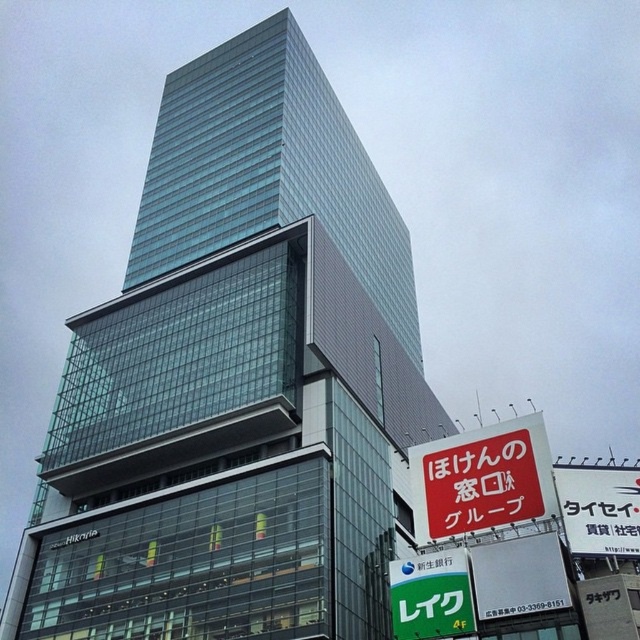
Question: Among these points, which one is farthest from the camera?

Choices:
 (A) coord(380,582)
 (B) coord(531,442)
 (C) coord(394,572)

Answer: (A)

Question: Is transparent glass building at center further to the viewer compared to red paper sign at lower right?

Choices:
 (A) yes
 (B) no

Answer: (A)

Question: Estimate the real-world distances between objects in this image. Which object is farther from the green plastic sign at lower center?

Choices:
 (A) red paper sign at lower right
 (B) transparent glass building at center

Answer: (B)

Question: Does transparent glass building at center appear on the right side of green plastic sign at lower center?

Choices:
 (A) no
 (B) yes

Answer: (A)

Question: Is transparent glass building at center above green plastic sign at lower center?

Choices:
 (A) no
 (B) yes

Answer: (B)

Question: Which of the following is the closest to the observer?

Choices:
 (A) (433, 561)
 (B) (512, 490)
 (C) (273, 566)

Answer: (A)